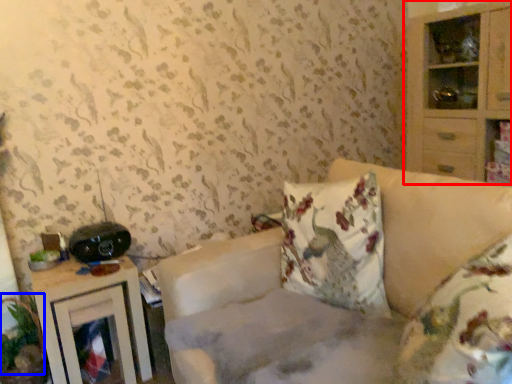
Question: Which object is further to the camera taking this photo, cabinetry (highlighted by a red box) or plant (highlighted by a blue box)?

Choices:
 (A) cabinetry
 (B) plant

Answer: (A)